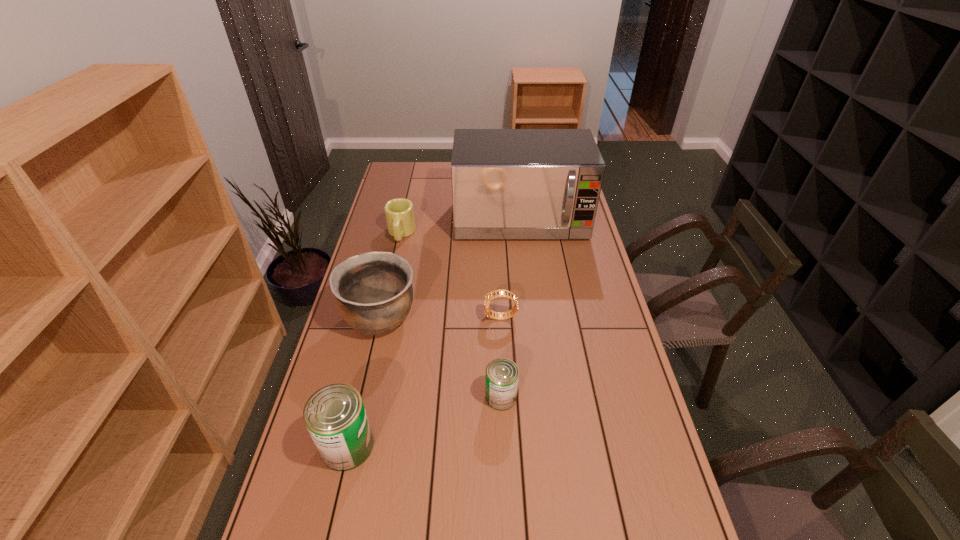
With all cans evenly spaced, where should an extra can be placed on the right to continue the pattern? Please point out a vacant space. Please provide its 2D coordinates. Your answer should be formatted as a tuple, i.e. [(x, y)], where the tuple contains the x and y coordinates of a point satisfying the conditions above.

[(630, 355)]